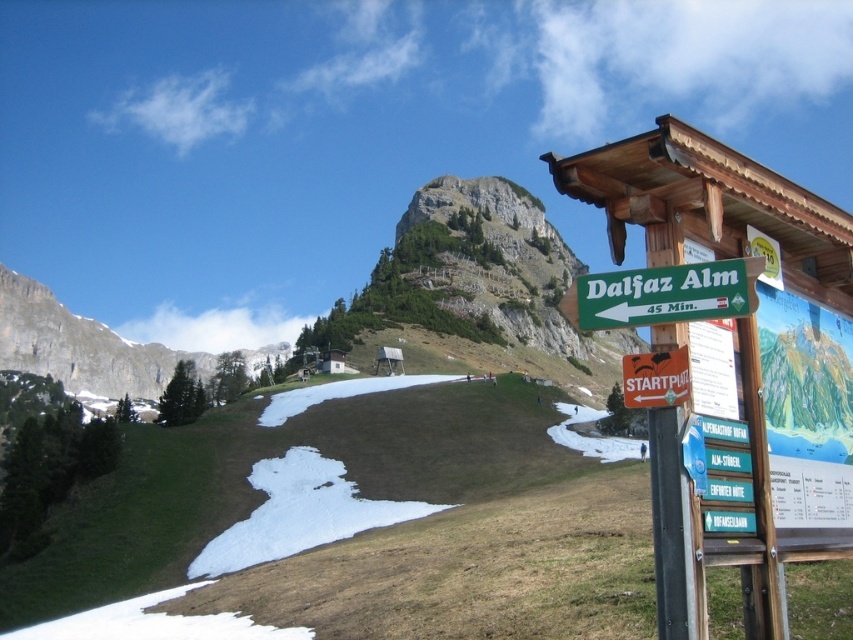
Question: Which point is closer to the camera?

Choices:
 (A) green plastic map at right
 (B) wooden signpost at upper right
 (C) green plastic sign at center-right

Answer: (B)

Question: Is green plastic map at right bigger than white plastic sign at center-right?

Choices:
 (A) no
 (B) yes

Answer: (A)

Question: Does wooden signpost at upper right have a lesser width compared to rocky gray mountain at upper left?

Choices:
 (A) yes
 (B) no

Answer: (A)

Question: Which object is the closest to the rocky gray mountain at upper left?

Choices:
 (A) green plastic sign at center-right
 (B) green plastic sign at right
 (C) white plastic sign at center-right
 (D) green plastic map at right

Answer: (A)

Question: Considering the relative positions of wooden signpost at upper right and white plastic sign at center-right in the image provided, where is wooden signpost at upper right located with respect to white plastic sign at center-right?

Choices:
 (A) right
 (B) left

Answer: (A)

Question: Which object is farther from the camera taking this photo?

Choices:
 (A) green plastic map at right
 (B) wooden signpost at upper right
 (C) rocky gray mountain at upper left
 (D) green plastic sign at right

Answer: (C)